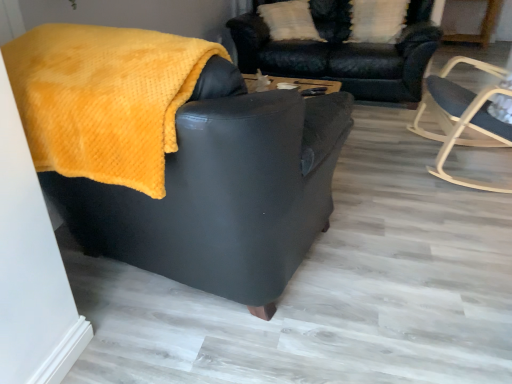
This screenshot has width=512, height=384. Describe the element at coordinates (222, 191) in the screenshot. I see `matte black armchair at center, which is counted as the second chair, starting from the right` at that location.

Image resolution: width=512 pixels, height=384 pixels. Identify the location of white textured pillow at upper center. (377, 20).

Is velvet black couch at upper center surrounding light wood rocking chair at right, acting as the 1th chair starting from the right?

No.

From the image's perspective, relative to light wood rocking chair at right, acting as the 1th chair starting from the right, is velvet black couch at upper center above or below?

Clearly, from the image's perspective, velvet black couch at upper center is above light wood rocking chair at right, acting as the 1th chair starting from the right.

From a real-world perspective, starting from the velvet black couch at upper center, which chair is the 1st one vertically above it? Please provide its 2D coordinates.

[(463, 118)]

Between point (423, 13) and point (432, 89), which one is positioned in front?

The point (432, 89) is closer.

Locate an element on the screen. pillow behind the light wood rocking chair at right, placed as the 2th chair when sorted from left to right is located at coordinates (377, 20).

How many degrees apart are the facing directions of white textured pillow at upper center and light wood rocking chair at right, acting as the 1th chair starting from the right?

The angular difference between white textured pillow at upper center and light wood rocking chair at right, acting as the 1th chair starting from the right, is 75.8 degrees.

Looking at this image, considering the sizes of white textured pillow at upper center and light wood rocking chair at right, placed as the 2th chair when sorted from left to right, in the image, is white textured pillow at upper center taller or shorter than light wood rocking chair at right, placed as the 2th chair when sorted from left to right,?

Considering their sizes, white textured pillow at upper center has less height than light wood rocking chair at right, placed as the 2th chair when sorted from left to right.

Does white textured pillow at upper center turn towards light wood rocking chair at right, placed as the 2th chair when sorted from left to right?

Yes, white textured pillow at upper center is oriented towards light wood rocking chair at right, placed as the 2th chair when sorted from left to right.

Considering the sizes of white textured pillow at upper center and matte black armchair at center, which is counted as the second chair, starting from the right, in the image, is white textured pillow at upper center wider or thinner than matte black armchair at center, which is counted as the second chair, starting from the right,?

Considering their sizes, white textured pillow at upper center looks slimmer than matte black armchair at center, which is counted as the second chair, starting from the right.

From a real-world perspective, which object stands above the other?

white textured pillow at upper center, from a real-world perspective.

Would you say matte black armchair at center, which is counted as the second chair, starting from the right, is part of white textured pillow at upper center's contents?

That's incorrect, matte black armchair at center, which is counted as the second chair, starting from the right, is not inside white textured pillow at upper center.

Looking at this image, from a real-world perspective, relative to velvet black couch at upper center, is matte black armchair at center, which is counted as the second chair, starting from the right, vertically above or below?

In terms of real-world spatial position, matte black armchair at center, which is counted as the second chair, starting from the right, is above velvet black couch at upper center.

Considering the positions of objects matte black armchair at center, which is counted as the second chair, starting from the right, and velvet black couch at upper center in the image provided, who is more to the right, matte black armchair at center, which is counted as the second chair, starting from the right, or velvet black couch at upper center?

velvet black couch at upper center is more to the right.

Is matte black armchair at center, the 1th chair viewed from the left, turned away from velvet black couch at upper center?

No, velvet black couch at upper center is not at the back of matte black armchair at center, the 1th chair viewed from the left.

From a real-world perspective, is light wood rocking chair at right, acting as the 1th chair starting from the right, positioned over white textured pillow at upper center based on gravity?

Actually, light wood rocking chair at right, acting as the 1th chair starting from the right, is physically below white textured pillow at upper center in the real world.

Considering the sizes of objects light wood rocking chair at right, acting as the 1th chair starting from the right, and white textured pillow at upper center in the image provided, who is shorter, light wood rocking chair at right, acting as the 1th chair starting from the right, or white textured pillow at upper center?

white textured pillow at upper center.

The image size is (512, 384). What are the coordinates of `pillow located above the light wood rocking chair at right, acting as the 1th chair starting from the right (from a real-world perspective)` in the screenshot? It's located at (377, 20).

You are a GUI agent. You are given a task and a screenshot of the screen. Output one action in this format:
    pyautogui.click(x=<x>, y=<y>)
    Task: Click on the pillow behind the matte black armchair at center, which is counted as the second chair, starting from the right
    
    Given the screenshot: What is the action you would take?
    pyautogui.click(x=377, y=20)

Is white textured pillow at upper center inside matte black armchair at center, the 1th chair viewed from the left?

No, matte black armchair at center, the 1th chair viewed from the left, does not contain white textured pillow at upper center.

Looking at this image, is the depth of matte black armchair at center, the 1th chair viewed from the left, less than that of white textured pillow at upper center?

Yes, it is.

From a real-world perspective, between light wood rocking chair at right, placed as the 2th chair when sorted from left to right, and matte black armchair at center, which is counted as the second chair, starting from the right, who is vertically higher?

matte black armchair at center, which is counted as the second chair, starting from the right.

Is light wood rocking chair at right, acting as the 1th chair starting from the right, facing away from matte black armchair at center, which is counted as the second chair, starting from the right?

No, light wood rocking chair at right, acting as the 1th chair starting from the right, is not facing the opposite direction of matte black armchair at center, which is counted as the second chair, starting from the right.

Which of these two, light wood rocking chair at right, placed as the 2th chair when sorted from left to right, or matte black armchair at center, the 1th chair viewed from the left, is wider?

matte black armchair at center, the 1th chair viewed from the left, is wider.

You are a GUI agent. You are given a task and a screenshot of the screen. Output one action in this format:
    pyautogui.click(x=<x>, y=<y>)
    Task: Click on the studio couch behind the light wood rocking chair at right, placed as the 2th chair when sorted from left to right
    The width and height of the screenshot is (512, 384).
    Given the screenshot: What is the action you would take?
    pyautogui.click(x=342, y=52)

You are a GUI agent. You are given a task and a screenshot of the screen. Output one action in this format:
    pyautogui.click(x=<x>, y=<y>)
    Task: Click on the chair on the right of white textured pillow at upper center
    
    Given the screenshot: What is the action you would take?
    pyautogui.click(x=463, y=118)

Looking at the image, which one is located further to white textured pillow at upper center, velvet black couch at upper center or light wood rocking chair at right, placed as the 2th chair when sorted from left to right?

light wood rocking chair at right, placed as the 2th chair when sorted from left to right, is positioned further to the anchor white textured pillow at upper center.

Based on their spatial positions, is white textured pillow at upper center or velvet black couch at upper center closer to matte black armchair at center, which is counted as the second chair, starting from the right?

The object closer to matte black armchair at center, which is counted as the second chair, starting from the right, is velvet black couch at upper center.

When comparing their distances from velvet black couch at upper center, does light wood rocking chair at right, placed as the 2th chair when sorted from left to right, or matte black armchair at center, the 1th chair viewed from the left, seem further?

matte black armchair at center, the 1th chair viewed from the left, is further to velvet black couch at upper center.

Looking at the image, which one is located closer to light wood rocking chair at right, placed as the 2th chair when sorted from left to right, matte black armchair at center, which is counted as the second chair, starting from the right, or white textured pillow at upper center?

Based on the image, white textured pillow at upper center appears to be nearer to light wood rocking chair at right, placed as the 2th chair when sorted from left to right.

Looking at the image, which one is located closer to white textured pillow at upper center, velvet black couch at upper center or matte black armchair at center, which is counted as the second chair, starting from the right?

The object closer to white textured pillow at upper center is velvet black couch at upper center.

When comparing their distances from velvet black couch at upper center, does white textured pillow at upper center or light wood rocking chair at right, acting as the 1th chair starting from the right, seem further?

light wood rocking chair at right, acting as the 1th chair starting from the right, is further to velvet black couch at upper center.

Which object lies nearer to the anchor point white textured pillow at upper center, light wood rocking chair at right, placed as the 2th chair when sorted from left to right, or velvet black couch at upper center?

The object closer to white textured pillow at upper center is velvet black couch at upper center.

Looking at the image, which one is located further to matte black armchair at center, which is counted as the second chair, starting from the right, velvet black couch at upper center or white textured pillow at upper center?

white textured pillow at upper center is positioned further to the anchor matte black armchair at center, which is counted as the second chair, starting from the right.

Where is `studio couch between light wood rocking chair at right, placed as the 2th chair when sorted from left to right, and white textured pillow at upper center in the front-back direction`? This screenshot has width=512, height=384. studio couch between light wood rocking chair at right, placed as the 2th chair when sorted from left to right, and white textured pillow at upper center in the front-back direction is located at coordinates (342, 52).

Find the location of a particular element. The height and width of the screenshot is (384, 512). chair between matte black armchair at center, which is counted as the second chair, starting from the right, and velvet black couch at upper center in the front-back direction is located at coordinates (463, 118).

At what (x,y) coordinates should I click in order to perform the action: click on studio couch between matte black armchair at center, the 1th chair viewed from the left, and white textured pillow at upper center in the front-back direction. Please return your answer as a coordinate pair (x, y). Looking at the image, I should click on (342, 52).

This screenshot has height=384, width=512. What are the coordinates of `chair positioned between matte black armchair at center, which is counted as the second chair, starting from the right, and white textured pillow at upper center from near to far` in the screenshot? It's located at (x=463, y=118).